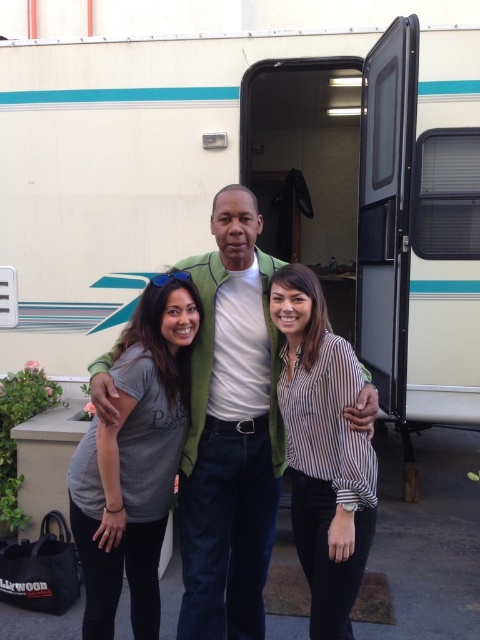
You are standing at the point with coordinates point (299,496) and want to see if you can see the point (72,470) from your current position. Considering the RV and other objects in the scene, can you see it?

Point (72,470) is behind point (299,496), so you cannot see it from your current position.